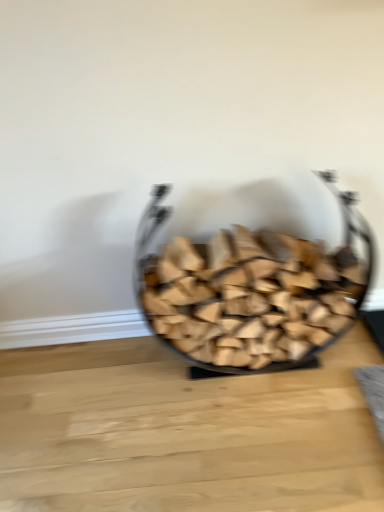
Find the location of a particular element. The height and width of the screenshot is (512, 384). vacant area situated below wooden logs at center (from a real-world perspective) is located at coordinates (269, 371).